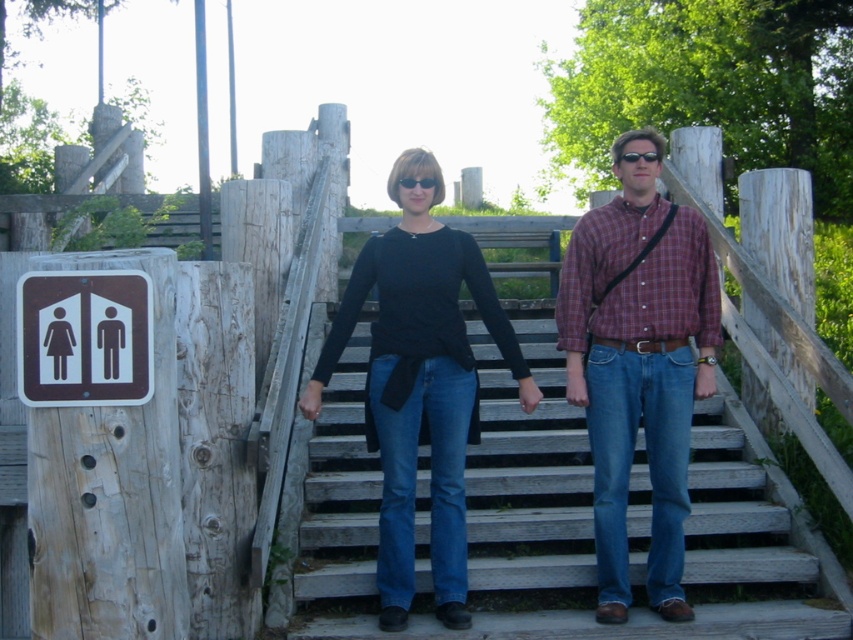
You are taking a photo of two people standing on stairs. You notice two specific points in the scene at coordinates point (x=701, y=260) and point (x=461, y=317). Which point is closer to the camera?

Point (x=461, y=317) is closer to the camera because it is positioned behind point (x=701, y=260), which is closer to the camera.

In the scene shown: You are a photographer standing at the bottom of the stairs. You want to take a photo of the plaid cotton shirt at center. Which direction should you move to get it in the frame?

The plaid cotton shirt at center is located at point 0.567 on the x axis and 0.750 on the y axis. Since you are at the bottom of the stairs, moving upwards along the stairs towards the center area would position the plaid cotton shirt at center within your camera frame.

You are a painter who needs to set up an easel. You have the wooden stairs at center and the plaid cotton shirt at center in your view. Which object can you use to place your easel on?

The wooden stairs at center is shorter than the plaid cotton shirt at center, so the wooden stairs at center would be the appropriate surface to place the easel since it is a stable, flat structure, whereas the plaid cotton shirt at center is a piece of clothing and cannot support the easel.